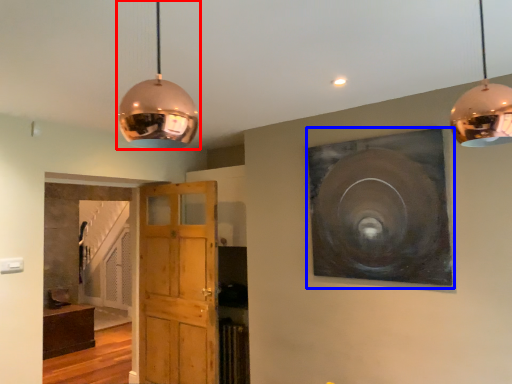
Question: Which object is further to the camera taking this photo, lamp (highlighted by a red box) or picture frame (highlighted by a blue box)?

Choices:
 (A) lamp
 (B) picture frame

Answer: (B)